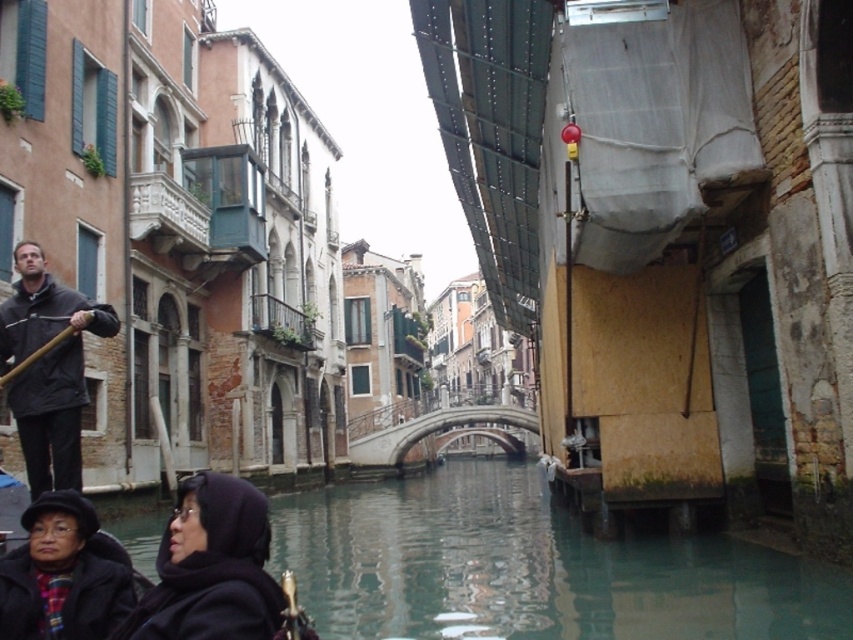
Question: Which of the following is the farthest from the observer?

Choices:
 (A) black woolen hat at lower left
 (B) dark purple fabric headscarf at lower left
 (C) greenish water at center

Answer: (C)

Question: Does greenish water at center lie behind dark purple fabric headscarf at lower left?

Choices:
 (A) yes
 (B) no

Answer: (A)

Question: Estimate the real-world distances between objects in this image. Which object is farther from the dark gray jacket at left?

Choices:
 (A) dark purple fabric headscarf at lower left
 (B) black woolen hat at lower left

Answer: (A)

Question: From the image, what is the correct spatial relationship of dark gray jacket at left in relation to black woolen hat at lower left?

Choices:
 (A) above
 (B) below

Answer: (A)

Question: Is greenish water at center wider than black woolen hat at lower left?

Choices:
 (A) no
 (B) yes

Answer: (B)

Question: Which of the following is the farthest from the observer?

Choices:
 (A) (212, 506)
 (B) (503, 520)
 (C) (38, 298)
 (D) (113, 564)

Answer: (B)